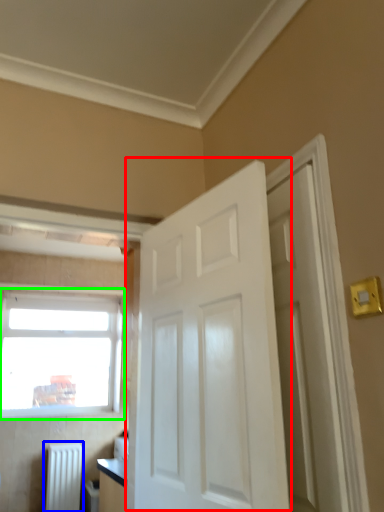
Question: Based on their relative distances, which object is nearer to door (highlighted by a red box)? Choose from radiator (highlighted by a blue box) and window (highlighted by a green box).

Choices:
 (A) radiator
 (B) window

Answer: (A)